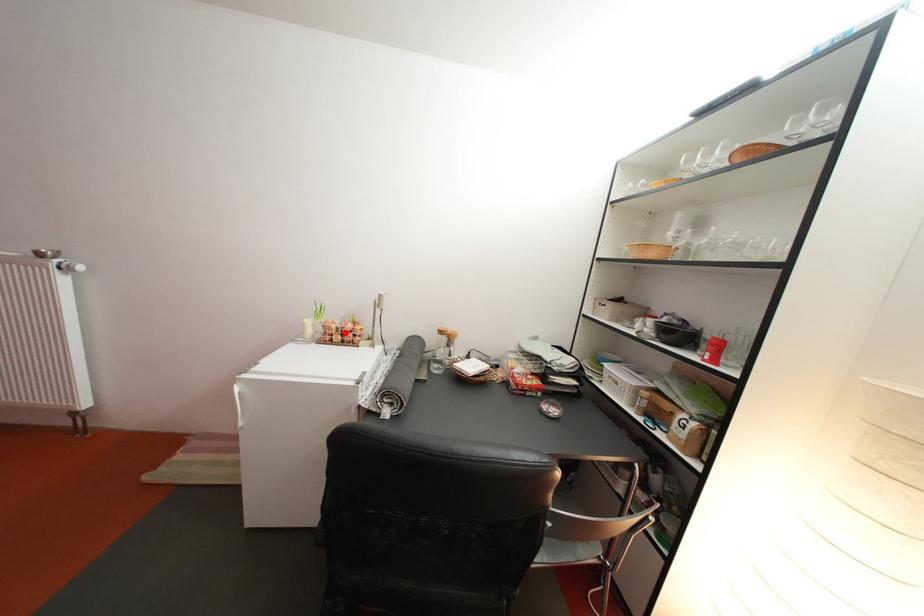
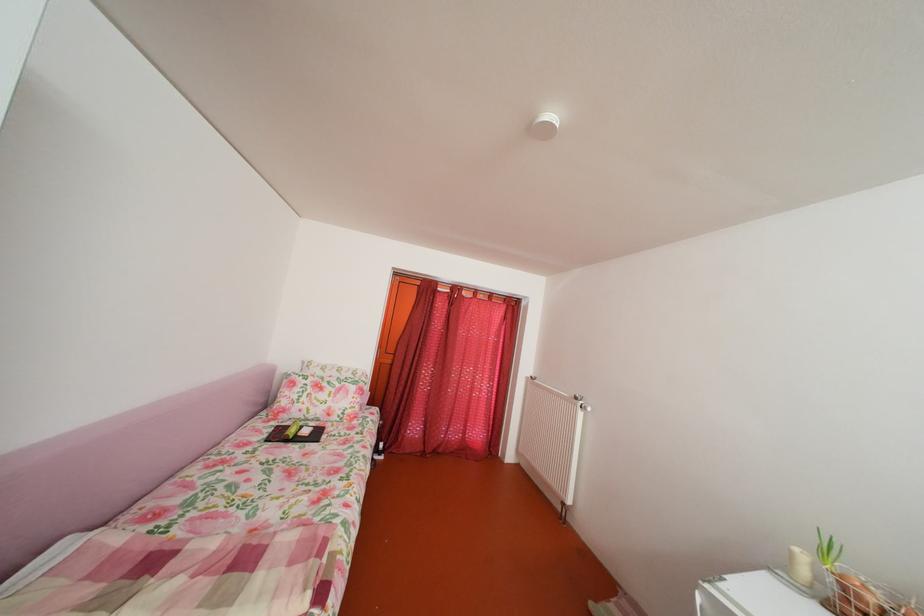
Where in the second image is the point corresponding to the highlighted location from the first image?

(882, 607)